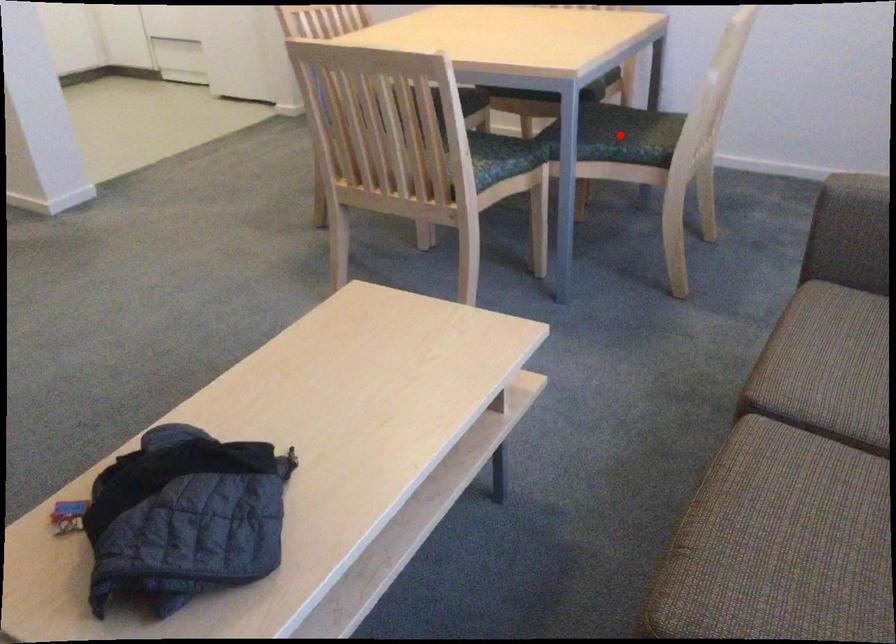
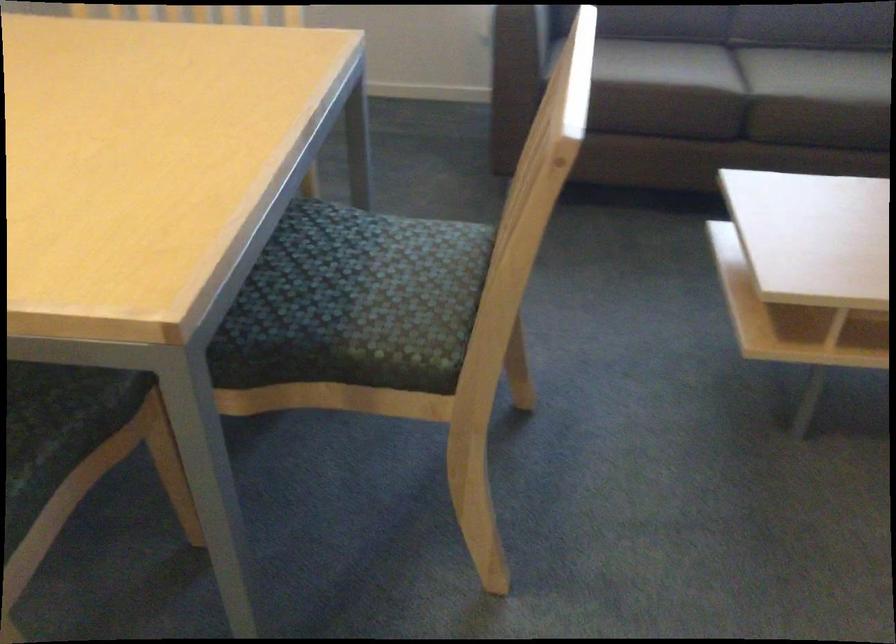
Question: I am providing you with two images of the same scene from different viewpoints. A red point is marked on the first image. Is the red point's position out of view in image 2?

Choices:
 (A) Yes
 (B) No

Answer: (A)